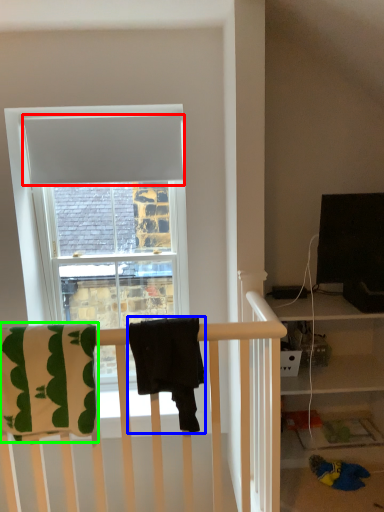
Question: Which is nearer to the curtain (highlighted by a red box)? beach towel (highlighted by a blue box) or beach towel (highlighted by a green box).

Choices:
 (A) beach towel
 (B) beach towel

Answer: (B)